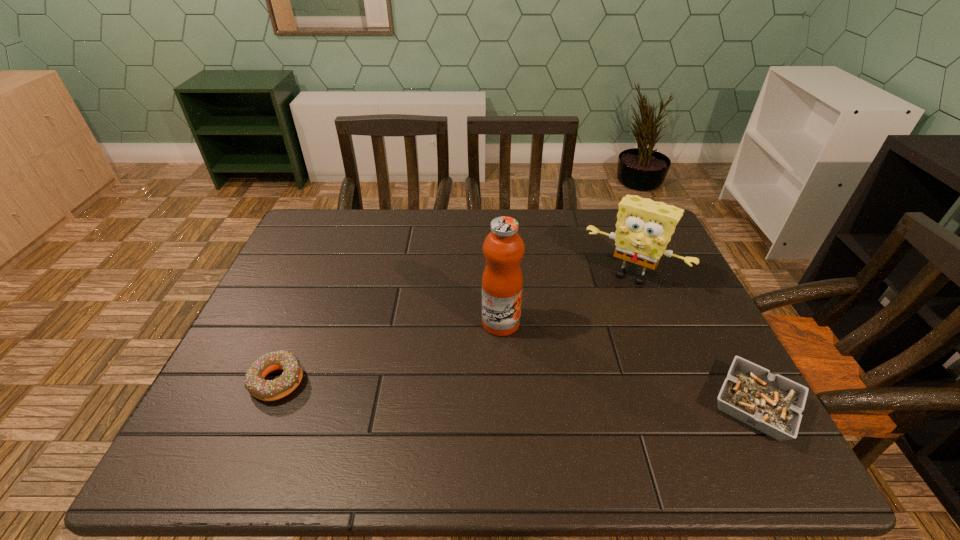
Locate an element on the screen. The width and height of the screenshot is (960, 540). vacant space on the desktop that is between the leftmost object and the ashtray and is positioned on the front label of the third object from right to left is located at coordinates (559, 396).

Identify the location of vacant spot on the desktop that is between the leftmost object and the ashtray and is positioned on the face of the second tallest object. (566, 396).